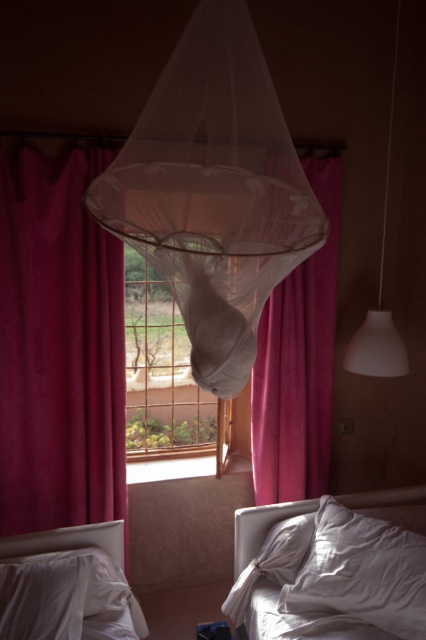
Looking at this image, you are trying to decide which object to move first to allow more light into the room. The velvet magenta curtain at left and the metallic wire mesh at center are both in your way. Which object is narrower and thus easier to move without blocking the light?

The velvet magenta curtain at left is narrower than the metallic wire mesh at center, so moving it first would be easier and less obstructive to the light.

In the cozy bedroom scene, there is a metallic wire mesh at center and a white matte lampshade at right. Which object is positioned closer to the left side of the room?

The metallic wire mesh at center is positioned to the left of the white matte lampshade at right, so it is closer to the left side of the room.